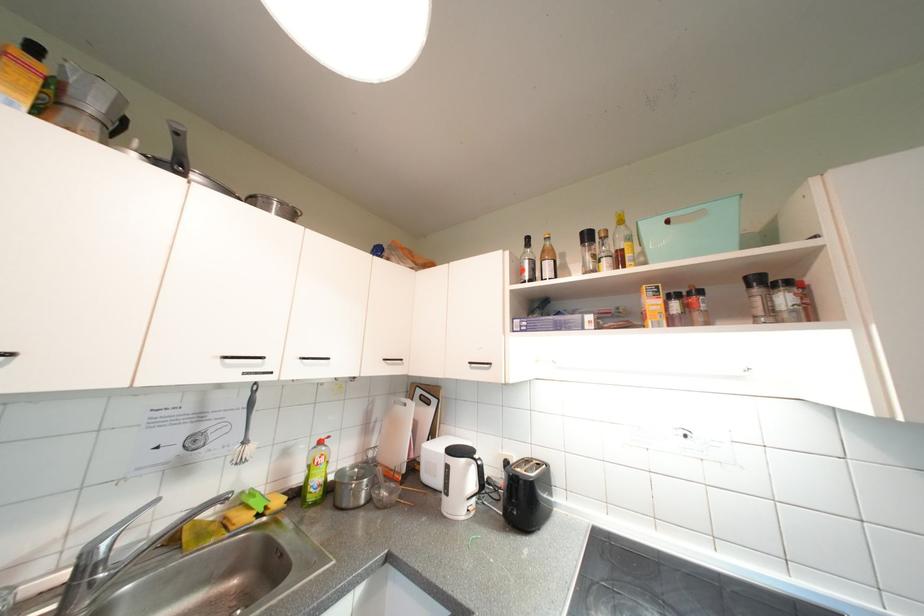
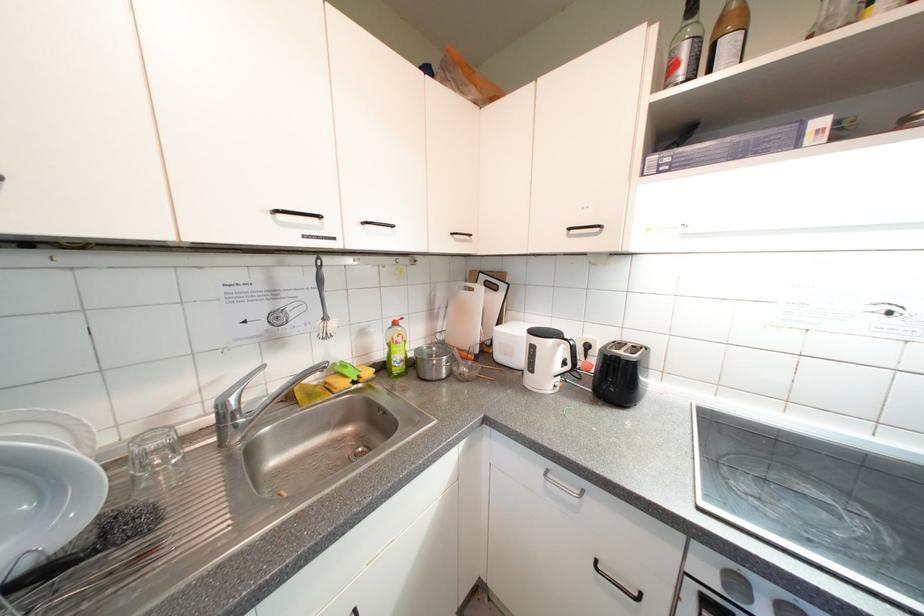
Find the pixel in the second image that matches the point at 478,365 in the first image.

(578, 231)